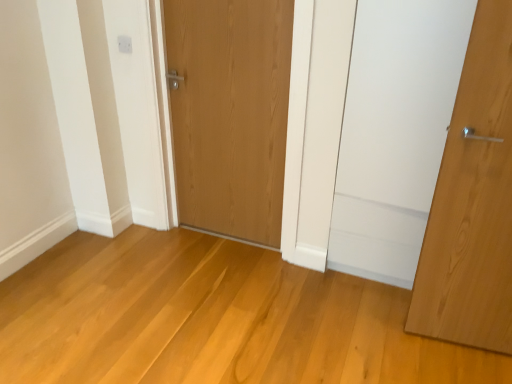
Question: From a real-world perspective, is natural wood door at right, the second door viewed from the back, positioned under white plastic electric outlet at upper center based on gravity?

Choices:
 (A) no
 (B) yes

Answer: (B)

Question: Considering the relative sizes of natural wood door at right, the second door viewed from the back, and white plastic electric outlet at upper center in the image provided, is natural wood door at right, the second door viewed from the back, bigger than white plastic electric outlet at upper center?

Choices:
 (A) yes
 (B) no

Answer: (A)

Question: Is natural wood door at right, positioned as the 1th door in front-to-back order, at the right side of white plastic electric outlet at upper center?

Choices:
 (A) yes
 (B) no

Answer: (A)

Question: Is the position of natural wood door at right, the second door viewed from the back, less distant than that of white plastic electric outlet at upper center?

Choices:
 (A) yes
 (B) no

Answer: (A)

Question: From the image's perspective, is natural wood door at right, the 1th door when ordered from right to left, located above white plastic electric outlet at upper center?

Choices:
 (A) no
 (B) yes

Answer: (A)

Question: From their relative heights in the image, would you say natural wood door at right, which is the 2th door from left to right, is taller or shorter than white plastic electric outlet at upper center?

Choices:
 (A) short
 (B) tall

Answer: (B)

Question: Is natural wood door at right, the second door viewed from the back, bigger or smaller than white plastic electric outlet at upper center?

Choices:
 (A) small
 (B) big

Answer: (B)

Question: From a real-world perspective, is natural wood door at right, the 1th door when ordered from right to left, physically located above or below white plastic electric outlet at upper center?

Choices:
 (A) below
 (B) above

Answer: (A)

Question: Considering their positions, is natural wood door at right, the 1th door when ordered from right to left, located in front of or behind white plastic electric outlet at upper center?

Choices:
 (A) behind
 (B) front

Answer: (B)

Question: Considering the relative positions of natural wood door at right, the 1th door when ordered from right to left, and wooden door at center, which is the second door from right to left, in the image provided, is natural wood door at right, the 1th door when ordered from right to left, to the left or to the right of wooden door at center, which is the second door from right to left,?

Choices:
 (A) right
 (B) left

Answer: (A)

Question: Is point (501, 299) closer or farther from the camera than point (248, 213)?

Choices:
 (A) closer
 (B) farther

Answer: (A)

Question: Considering their positions, is natural wood door at right, which is the 2th door from left to right, located in front of or behind wooden door at center, which is the second door from right to left?

Choices:
 (A) front
 (B) behind

Answer: (A)

Question: From the image's perspective, is natural wood door at right, positioned as the 1th door in front-to-back order, positioned above or below wooden door at center, which is the second door from right to left?

Choices:
 (A) above
 (B) below

Answer: (B)

Question: From a real-world perspective, is wooden door at center, which ranks as the second door in front-to-back order, physically located above or below white plastic electric outlet at upper center?

Choices:
 (A) below
 (B) above

Answer: (A)

Question: In terms of size, does wooden door at center, which ranks as the 1th door in left-to-right order, appear bigger or smaller than white plastic electric outlet at upper center?

Choices:
 (A) small
 (B) big

Answer: (B)